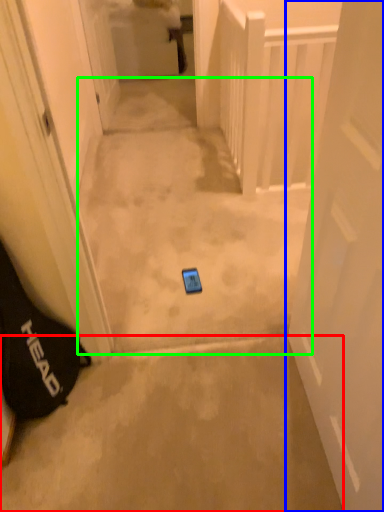
Question: Which is nearer to the concrete (highlighted by a red box)? door (highlighted by a blue box) or path (highlighted by a green box).

Choices:
 (A) door
 (B) path

Answer: (A)